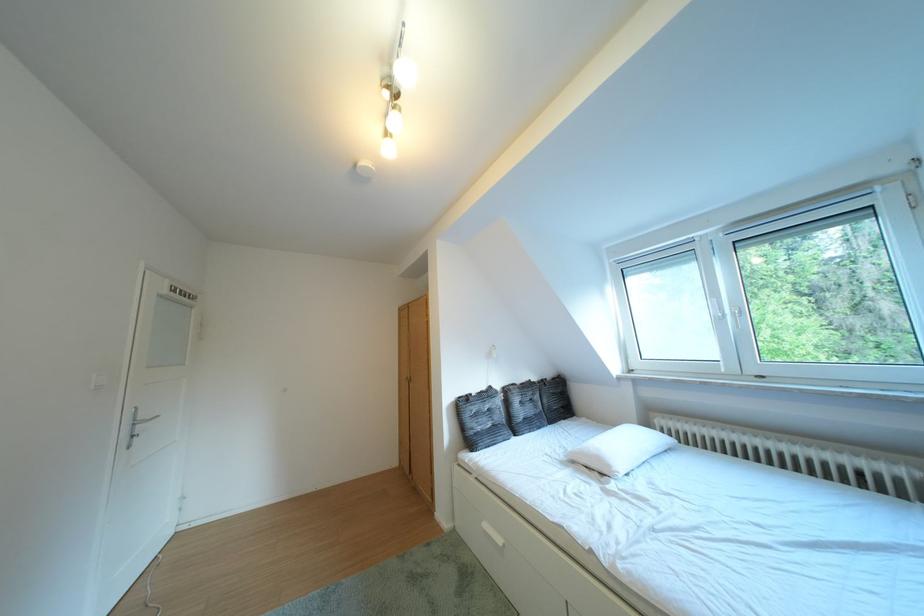
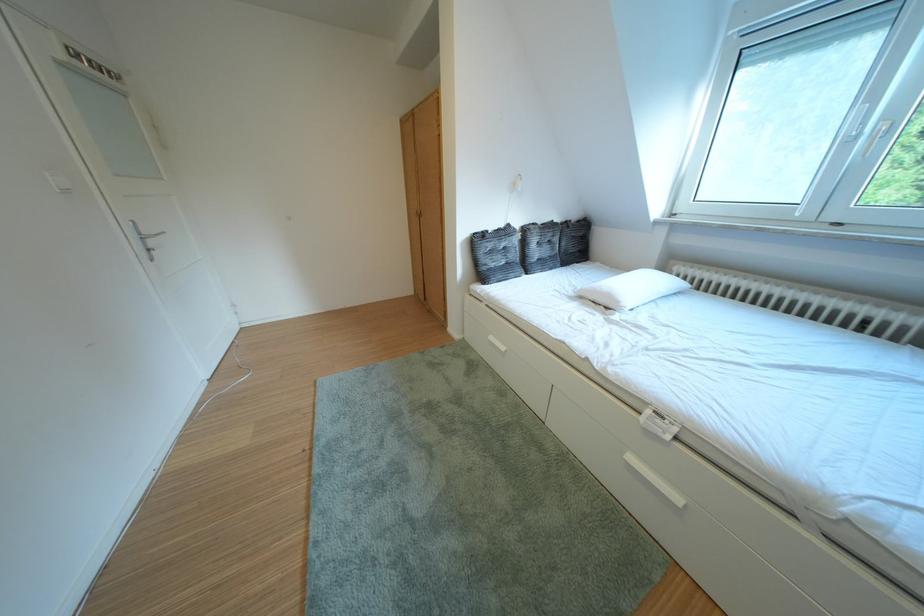
Find the pixel in the second image that matches (504,392) in the first image.

(523, 230)